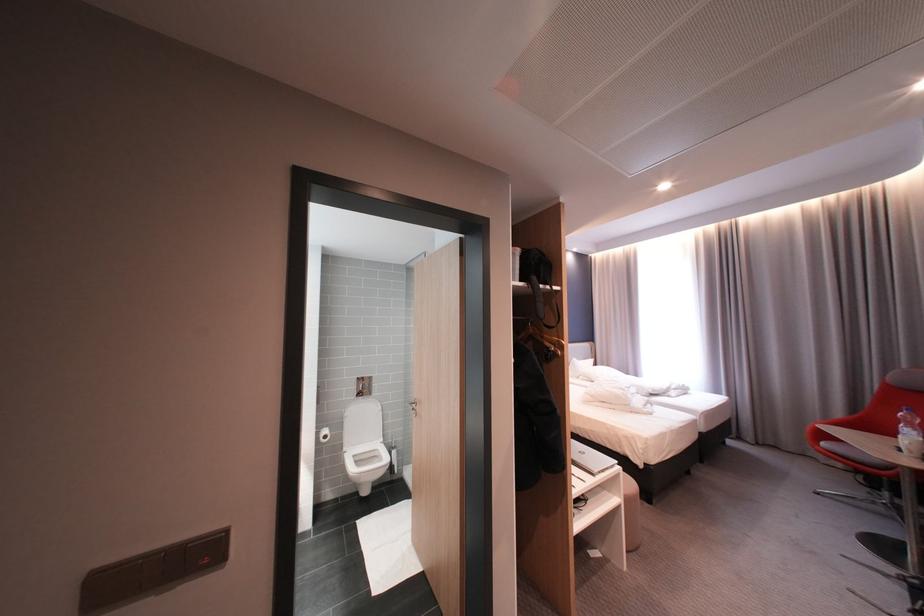
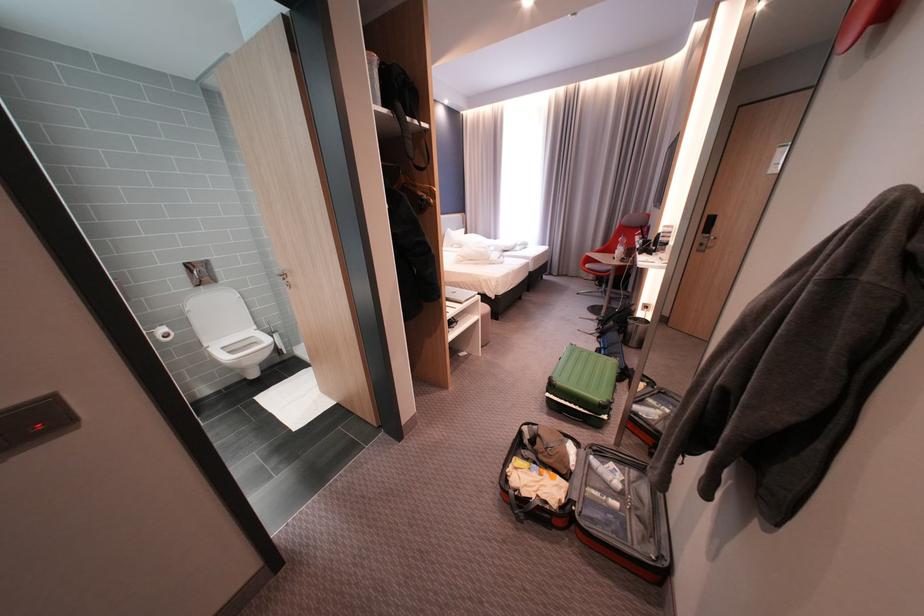
Find the pixel in the second image that matches pixel 358 416 in the first image.

(201, 312)